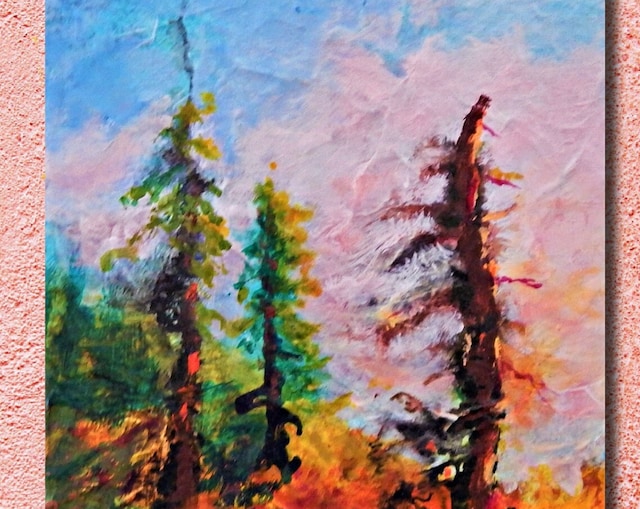
Locate an element on the screen. Image resolution: width=640 pixels, height=509 pixels. wall is located at coordinates (633, 207), (26, 213).